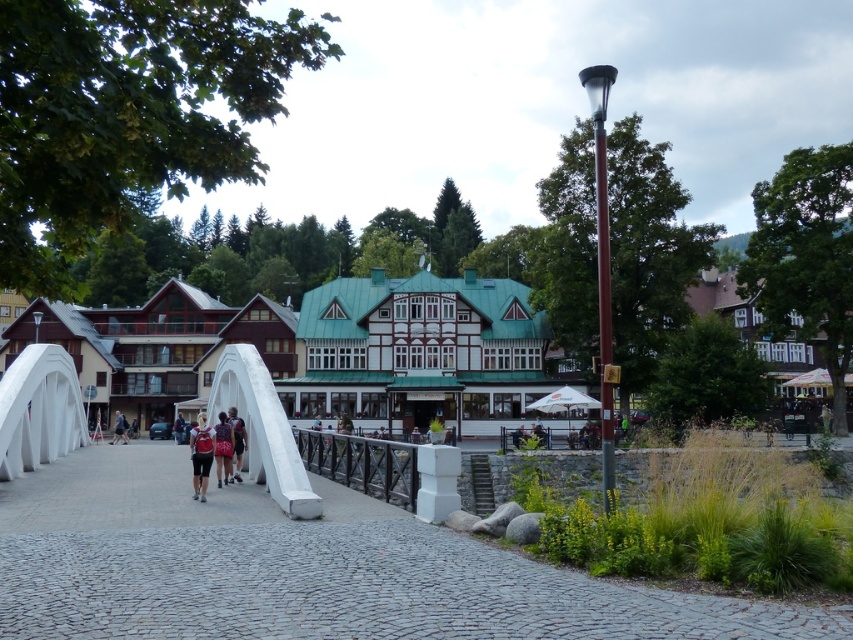
Question: Estimate the real-world distances between objects in this image. Which object is closer to the dark blue backpack at center?

Choices:
 (A) green wooden building at center
 (B) black metal/rail at center
 (C) matte red backpack at center

Answer: (C)

Question: From the image, what is the correct spatial relationship of green wooden building at center in relation to red backpack at center?

Choices:
 (A) below
 (B) above

Answer: (B)

Question: Can you confirm if black metal/rail at center is positioned to the left of dark blue backpack at center?

Choices:
 (A) yes
 (B) no

Answer: (B)

Question: Among these objects, which one is nearest to the camera?

Choices:
 (A) matte red backpack at center
 (B) dark blue backpack at center
 (C) black metal/rail at center

Answer: (C)

Question: In this image, where is black metal/rail at center located relative to red backpack at center?

Choices:
 (A) right
 (B) left

Answer: (A)

Question: Which point is farther to the camera?

Choices:
 (A) (194, 435)
 (B) (120, 429)

Answer: (B)